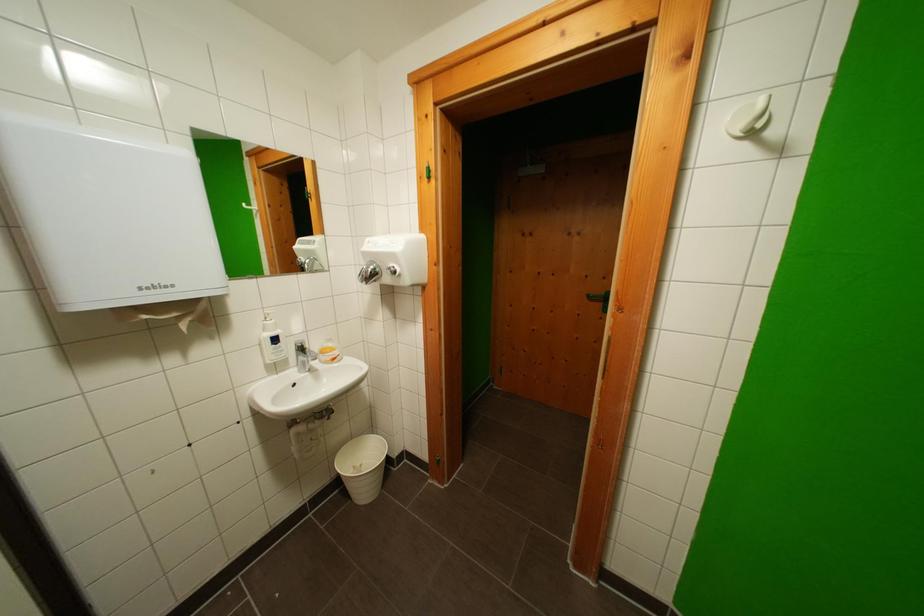
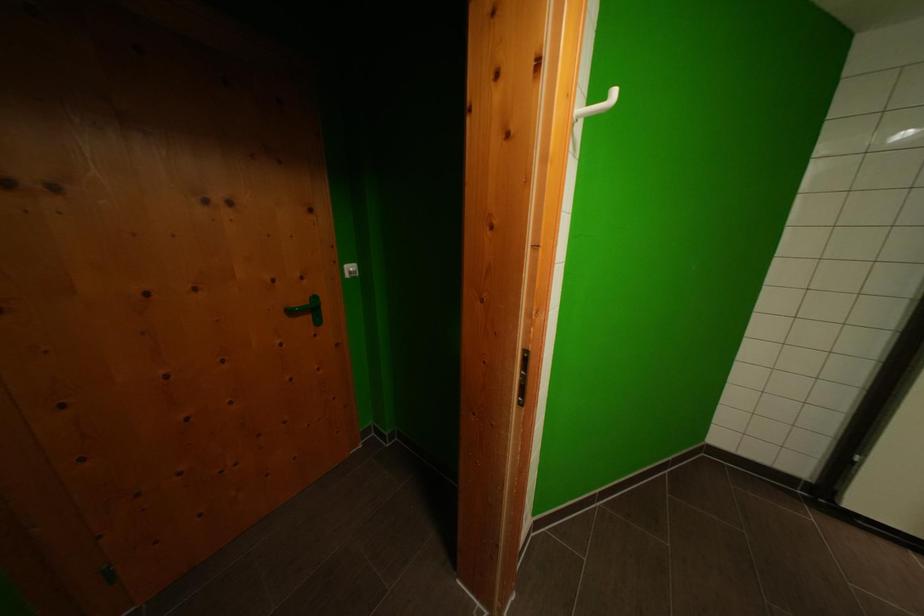
Question: The camera is either moving clockwise (left) or counter-clockwise (right) around the object. The first image is from the beginning of the video and the second image is from the end. Is the camera moving left or right when shooting the video?

Choices:
 (A) Left
 (B) Right

Answer: (A)